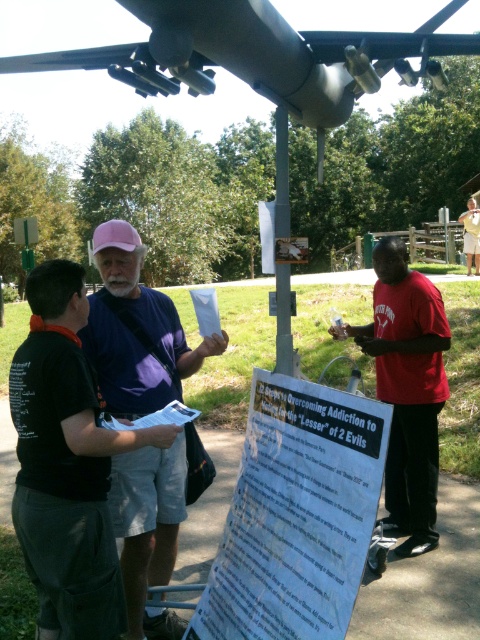
You are a visitor at an outdoor event and want to locate the information board. You see the metallic signpost at center and the red shirt at right. Which object is bigger in size?

The metallic signpost at center is larger in size compared to the red shirt at right.

You are a tour guide leading a group near the helicopter display. You need to point out both the white paper sign at center and the pink fabric cap at upper left to your visitors. Which object is located to the right of the other?

The white paper sign at center is to the right of the pink fabric cap at upper left.

You are a photographer trying to capture a group photo of the pink fabric cap at upper left and the red shirt at right. Since you want both subjects to be in the frame, which direction should you move your camera to ensure both are visible?

The pink fabric cap at upper left is positioned on the left side of red shirt at right, so you should move your camera slightly to the left to ensure both subjects are visible in the frame.